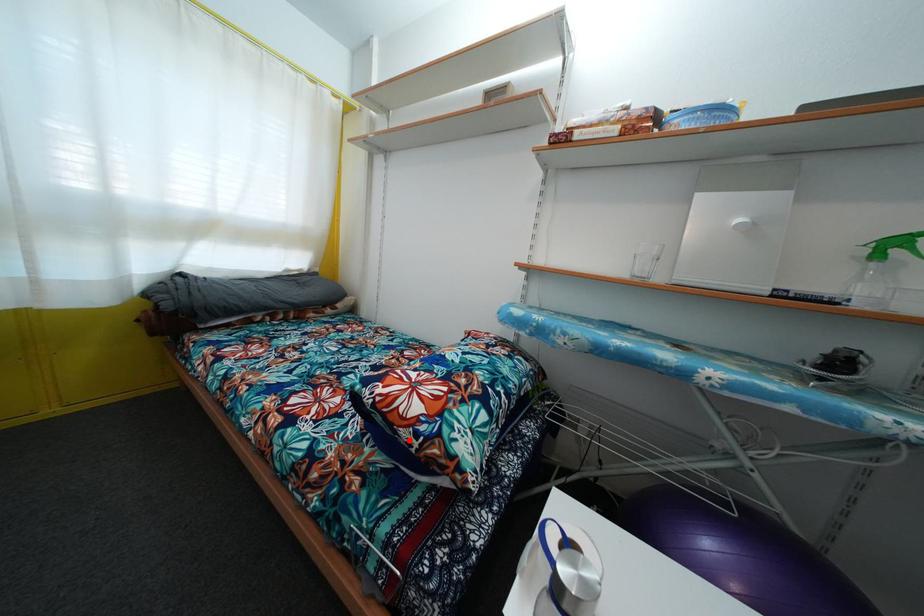
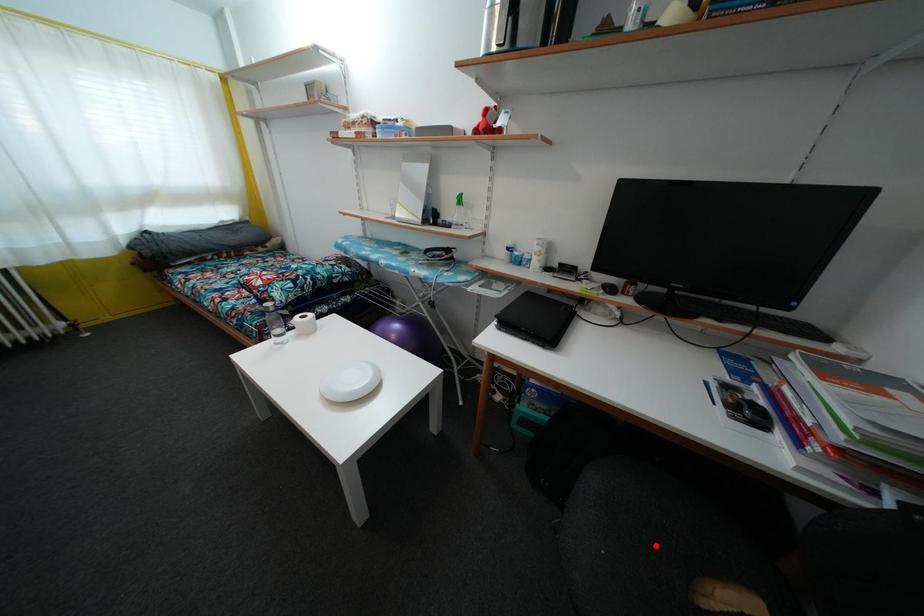
I am providing you with two images of the same scene from different viewpoints. A red point is marked on the first image and another point is marked on the second image. Does the point marked in image1 correspond to the same location as the one in image2?

No